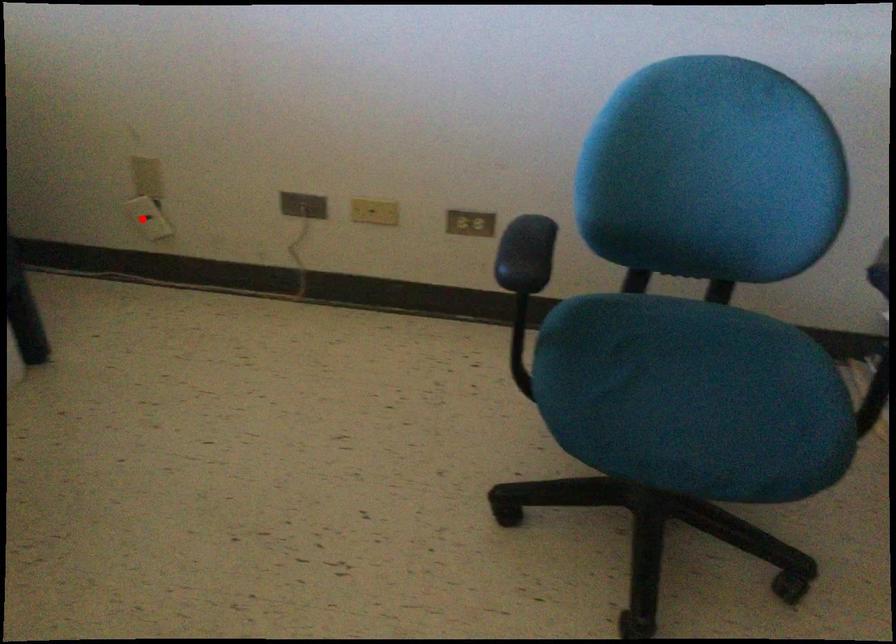
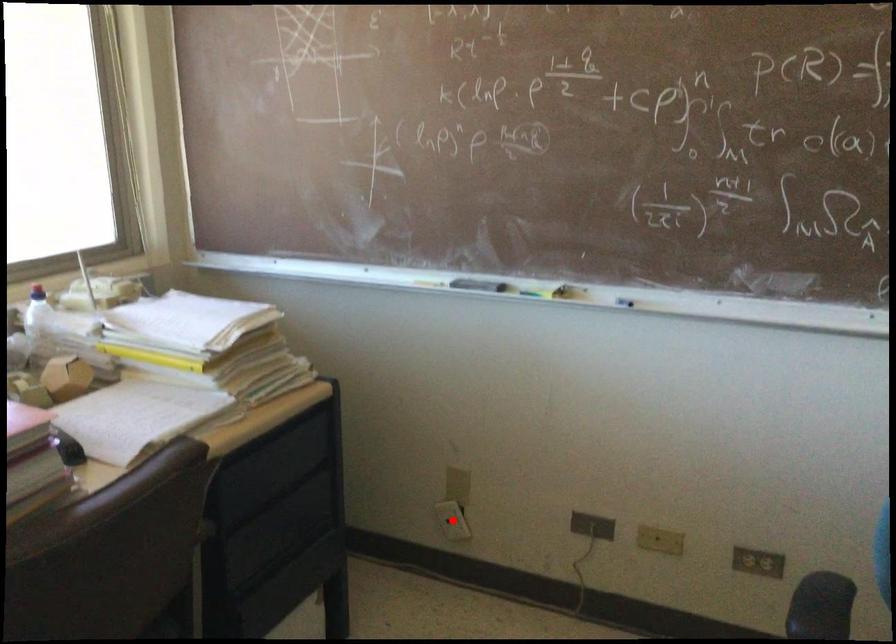
I am providing you with two images of the same scene from different viewpoints. A red point is marked on the first image and another point is marked on the second image. Is the red point in image1 aligned with the point shown in image2?

Yes